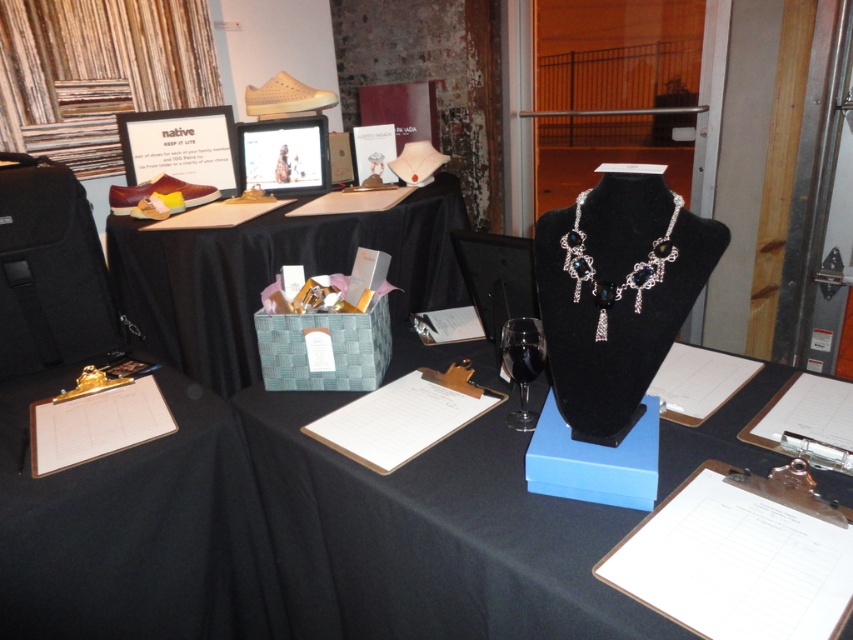
You are setting up a display and need to place a 18 inch wide decorative item between the woven fabric basket at center and the white paper clipboard at center. Is there enough space?

The woven fabric basket at center and white paper clipboard at center are 21.45 inches apart from each other. Since the decorative item is 18 inches wide, there is enough space between them to place it.

You are setting up a booth and need to attach a large sign to one of the clipboards. Which clipboard, the black fabric clipboard at lower left or the white paper clipboard at center, is more suitable based on their width?

The black fabric clipboard at lower left might be wider than the white paper clipboard at center, making it more suitable for a large sign due to its potential wider surface area.

You are a visitor at the exhibition and you see the white paper clipboard at center and the gold metal clipboard at lower left. Which one is positioned higher in the image?

The white paper clipboard at center is positioned higher than the gold metal clipboard at lower left.